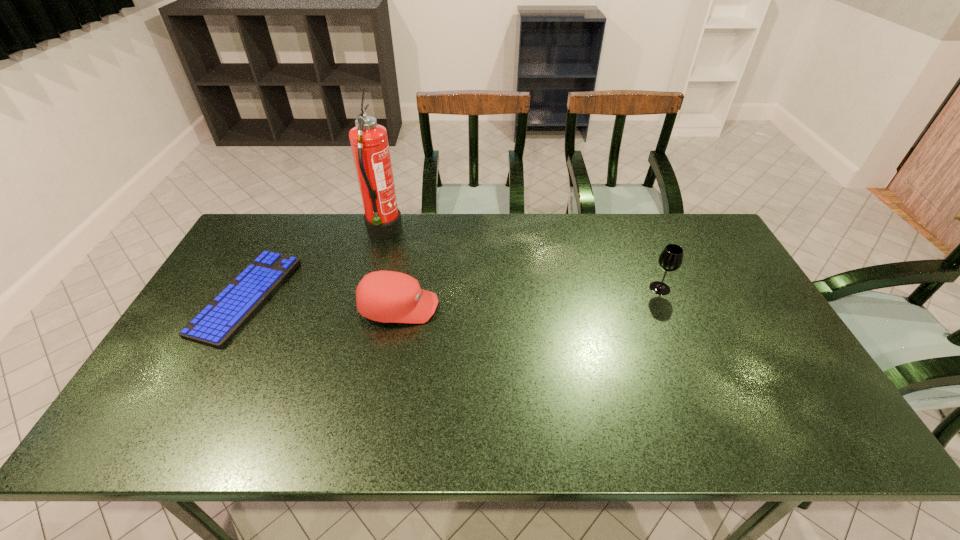
You are a GUI agent. You are given a task and a screenshot of the screen. Output one action in this format:
    pyautogui.click(x=<x>, y=<y>)
    Task: Click on the free spot between the rightmost object and the fire extinguisher
    
    Given the screenshot: What is the action you would take?
    pyautogui.click(x=521, y=261)

Locate an element on the screen. vacant region between the fire extinguisher and the third shortest object is located at coordinates (521, 261).

You are a GUI agent. You are given a task and a screenshot of the screen. Output one action in this format:
    pyautogui.click(x=<x>, y=<y>)
    Task: Click on the free space between the leftmost object and the fire extinguisher
    
    Given the screenshot: What is the action you would take?
    pyautogui.click(x=315, y=265)

Find the location of a particular element. vacant space that's between the leftmost object and the tallest object is located at coordinates (315, 265).

The height and width of the screenshot is (540, 960). What are the coordinates of `free spot between the fire extinguisher and the wineglass` in the screenshot? It's located at (521, 261).

Where is `free spot between the shortest object and the second tallest object`? free spot between the shortest object and the second tallest object is located at coordinates point(453,293).

At what (x,y) coordinates should I click in order to perform the action: click on free area in between the farthest object and the shortest object. Please return your answer as a coordinate pair (x, y). Image resolution: width=960 pixels, height=540 pixels. Looking at the image, I should click on (315, 265).

The width and height of the screenshot is (960, 540). What are the coordinates of `vacant point located between the tallest object and the shortest object` in the screenshot? It's located at (315, 265).

Where is `vacant point located between the third tallest object and the farthest object`? The width and height of the screenshot is (960, 540). vacant point located between the third tallest object and the farthest object is located at coordinates (392, 270).

Where is `object that can be found as the second closest to the third tallest object`? object that can be found as the second closest to the third tallest object is located at coordinates (217, 323).